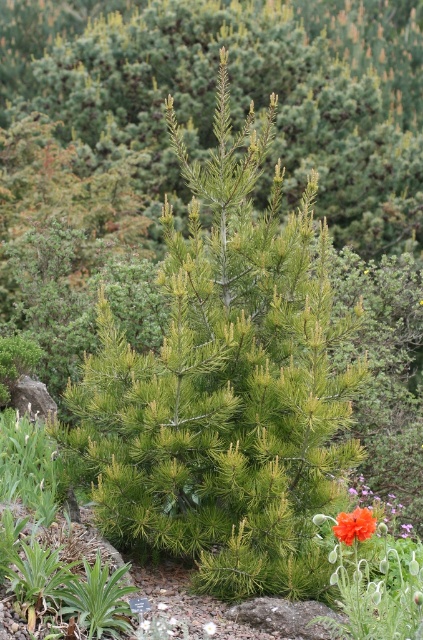
The width and height of the screenshot is (423, 640). I want to click on green needle-like tree at center, so click(x=225, y=385).

Who is shorter, green needle-like tree at center or orange matte flower at center?

With less height is orange matte flower at center.

At what (x,y) coordinates should I click in order to perform the action: click on green needle-like tree at center. Please return your answer as a coordinate pair (x, y). The height and width of the screenshot is (640, 423). Looking at the image, I should click on (225, 385).

Identify the location of green needle-like tree at center. (225, 385).

Is green needle-like tree at center wider than white matte flower at center?

Correct, the width of green needle-like tree at center exceeds that of white matte flower at center.

Is the position of green needle-like tree at center less distant than that of white matte flower at center?

No, it is behind white matte flower at center.

Consider the image. Who is more distant from viewer, (x=181, y=525) or (x=213, y=630)?

The point (x=181, y=525) is behind.

This screenshot has height=640, width=423. I want to click on green needle-like tree at center, so click(x=225, y=385).

Who is more forward, (335,531) or (214,632)?

Point (335,531) is in front.

Can you confirm if orange matte flower at center is thinner than white matte flower at center?

No.

Who is more forward, (351, 540) or (206, 627)?

Point (351, 540)

The image size is (423, 640). I want to click on orange matte flower at center, so click(354, 525).